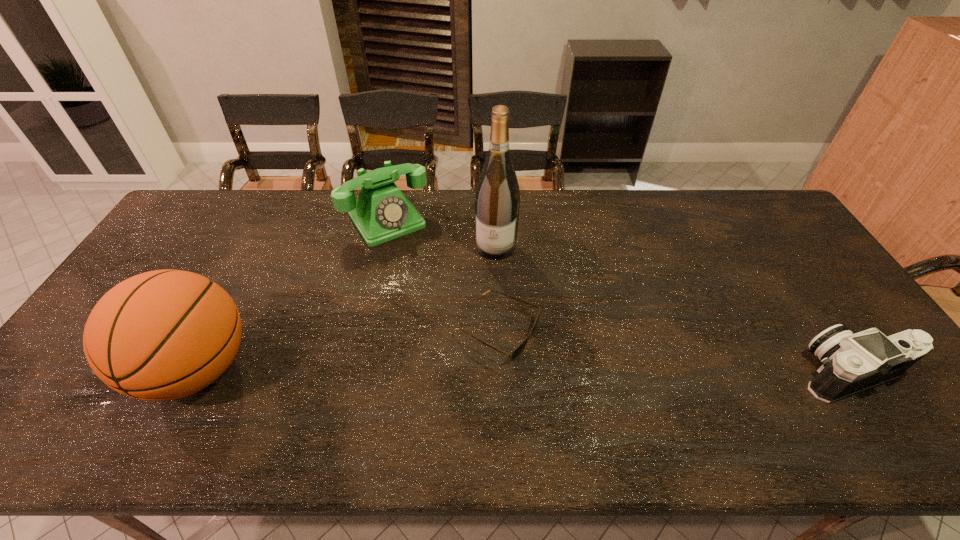
Where is `free point between the leftmost object and the fourth object from right to left`? free point between the leftmost object and the fourth object from right to left is located at coordinates (293, 295).

At what (x,y) coordinates should I click in order to perform the action: click on vacant space that is in between the sunglasses and the basketball. Please return your answer as a coordinate pair (x, y). Looking at the image, I should click on (348, 350).

I want to click on empty space that is in between the second tallest object and the fourth tallest object, so click(523, 371).

I want to click on empty location between the rightmost object and the tallest object, so click(673, 310).

Find the location of a particular element. The width and height of the screenshot is (960, 540). empty space that is in between the tallest object and the second object from left to right is located at coordinates (442, 234).

Locate an element on the screen. Image resolution: width=960 pixels, height=540 pixels. empty space that is in between the tallest object and the second shortest object is located at coordinates (673, 310).

Locate an element on the screen. Image resolution: width=960 pixels, height=540 pixels. free space between the rightmost object and the shortest object is located at coordinates (673, 352).

Identify the location of free point between the third tallest object and the shortest object. The image size is (960, 540). (443, 275).

Identify the location of vacant area that lies between the fourth tallest object and the leftmost object. (523, 371).

Locate an element on the screen. This screenshot has height=540, width=960. free space between the rightmost object and the wine bottle is located at coordinates (673, 310).